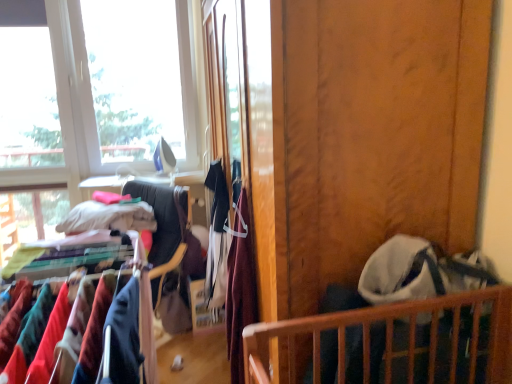
Identify the location of white cotton shirt at center, the 2th clothing from the right. The height and width of the screenshot is (384, 512). (217, 238).

Describe the element at coordinates (389, 339) in the screenshot. I see `wooden crib at lower right` at that location.

At what (x,y) coordinates should I click in order to perform the action: click on velvet burgundy dress at center, which is the 1th clothing from front to back. Please return your answer as a coordinate pair (x, y). The height and width of the screenshot is (384, 512). Looking at the image, I should click on (240, 288).

The width and height of the screenshot is (512, 384). I want to click on white cotton shirt at center, arranged as the 2th clothing when viewed from the front, so click(x=217, y=238).

Consider the image. Is wooden screen door at center not inside wooden crib at lower right?

Yes, wooden screen door at center is located beyond the bounds of wooden crib at lower right.

Could you tell me if wooden screen door at center is turned towards wooden crib at lower right?

No, wooden screen door at center is not turned towards wooden crib at lower right.

From the image's perspective, does wooden screen door at center appear higher than wooden crib at lower right?

Indeed, from the image's perspective, wooden screen door at center is shown above wooden crib at lower right.

Considering the points (439, 381) and (169, 209), which point is in front, point (439, 381) or point (169, 209)?

The point (439, 381) is closer to the camera.

From the image's perspective, relative to velvet fabric clothes at center, is wooden crib at lower right above or below?

Clearly, from the image's perspective, wooden crib at lower right is below velvet fabric clothes at center.

Which of these two, wooden crib at lower right or velvet fabric clothes at center, stands shorter?

wooden crib at lower right is shorter.

Looking at this image, does wooden crib at lower right have a greater width compared to velvet fabric clothes at center?

No.

From a real-world perspective, is wooden crib at lower right physically located above or below velvet burgundy dress at center, which is the 1th clothing from front to back?

In terms of real-world spatial position, wooden crib at lower right is below velvet burgundy dress at center, which is the 1th clothing from front to back.

How many degrees apart are the facing directions of wooden crib at lower right and velvet burgundy dress at center, which is the second clothing from left to right?

The angular difference between wooden crib at lower right and velvet burgundy dress at center, which is the second clothing from left to right, is 1.77 degrees.

Where is `the 1st clothing to the left of the wooden crib at lower right, counting from the anchor's position`? Image resolution: width=512 pixels, height=384 pixels. the 1st clothing to the left of the wooden crib at lower right, counting from the anchor's position is located at coordinates (240, 288).

Is wooden crib at lower right to the left of velvet burgundy dress at center, which is the 1th clothing from front to back, from the viewer's perspective?

No, wooden crib at lower right is not to the left of velvet burgundy dress at center, which is the 1th clothing from front to back.

Which object is further away from the camera taking this photo, wooden screen door at center or velvet burgundy dress at center, marked as the 1th clothing in a right-to-left arrangement?

velvet burgundy dress at center, marked as the 1th clothing in a right-to-left arrangement, is behind.

What's the angular difference between wooden screen door at center and velvet burgundy dress at center, marked as the 1th clothing in a right-to-left arrangement,'s facing directions?

The facing directions of wooden screen door at center and velvet burgundy dress at center, marked as the 1th clothing in a right-to-left arrangement, are 1.53 degrees apart.

Does wooden screen door at center touch velvet burgundy dress at center, which is the second clothing from left to right?

There is a gap between wooden screen door at center and velvet burgundy dress at center, which is the second clothing from left to right.

From a real-world perspective, which object rests below the other?

In real-world perspective, velvet burgundy dress at center, which is the 1th clothing from front to back, is lower.

In terms of size, does velvet burgundy dress at center, which is the second clothing from left to right, appear bigger or smaller than wooden screen door at center?

Clearly, velvet burgundy dress at center, which is the second clothing from left to right, is smaller in size than wooden screen door at center.

Starting from the wooden screen door at center, which clothing is the 1st one behind? Please provide its 2D coordinates.

[(240, 288)]

Can you confirm if velvet burgundy dress at center, which is the second clothing from left to right, is positioned to the left of wooden screen door at center?

Yes.

Is velvet burgundy dress at center, marked as the 1th clothing in a right-to-left arrangement, turned away from wooden screen door at center?

Yes, velvet burgundy dress at center, marked as the 1th clothing in a right-to-left arrangement,'s orientation is away from wooden screen door at center.

Would you consider white cotton shirt at center, the first clothing positioned from the back, to be distant from wooden crib at lower right?

They are positioned close to each other.

Considering the relative sizes of white cotton shirt at center, the 2th clothing from the right, and wooden crib at lower right in the image provided, is white cotton shirt at center, the 2th clothing from the right, wider than wooden crib at lower right?

No, white cotton shirt at center, the 2th clothing from the right, is not wider than wooden crib at lower right.

Is point (226, 269) more distant than point (317, 334)?

Yes, it is.

From the image's perspective, is velvet fabric clothes at center positioned above or below wooden screen door at center?

Based on their image positions, velvet fabric clothes at center is located beneath wooden screen door at center.

Which object is thinner, velvet fabric clothes at center or wooden screen door at center?

Thinner between the two is wooden screen door at center.

Considering the positions of objects velvet fabric clothes at center and wooden screen door at center in the image provided, who is more to the right, velvet fabric clothes at center or wooden screen door at center?

Positioned to the right is wooden screen door at center.

Where is `furniture located behind the wooden screen door at center`? The width and height of the screenshot is (512, 384). furniture located behind the wooden screen door at center is located at coordinates (389, 339).

Where is `closet above the wooden crib at lower right (from the image's perspective)`? The height and width of the screenshot is (384, 512). closet above the wooden crib at lower right (from the image's perspective) is located at coordinates (163, 217).

Looking at the image, which one is located further to wooden screen door at center, velvet fabric clothes at center or white cotton shirt at center, arranged as the 2th clothing when viewed from the front?

velvet fabric clothes at center lies further to wooden screen door at center than the other object.

From the image, which object appears to be nearer to velvet burgundy dress at center, which is the second clothing from left to right, velvet fabric clothes at center or wooden crib at lower right?

The object closer to velvet burgundy dress at center, which is the second clothing from left to right, is wooden crib at lower right.

Based on their spatial positions, is white cotton shirt at center, which is counted as the 1th clothing, starting from the left, or wooden screen door at center further from velvet burgundy dress at center, placed as the 2th clothing when sorted from back to front?

Among the two, wooden screen door at center is located further to velvet burgundy dress at center, placed as the 2th clothing when sorted from back to front.

Estimate the real-world distances between objects in this image. Which object is further from wooden screen door at center, wooden crib at lower right or velvet burgundy dress at center, which is the second clothing from left to right?

velvet burgundy dress at center, which is the second clothing from left to right, is further to wooden screen door at center.

Estimate the real-world distances between objects in this image. Which object is further from wooden screen door at center, velvet fabric clothes at center or velvet burgundy dress at center, placed as the 2th clothing when sorted from back to front?

velvet fabric clothes at center.

Considering their positions, is wooden screen door at center positioned further to wooden crib at lower right than white cotton shirt at center, arranged as the 2th clothing when viewed from the front?

white cotton shirt at center, arranged as the 2th clothing when viewed from the front, is positioned further to the anchor wooden crib at lower right.

When comparing their distances from white cotton shirt at center, the first clothing positioned from the back, does velvet fabric clothes at center or velvet burgundy dress at center, marked as the 1th clothing in a right-to-left arrangement, seem further?

velvet fabric clothes at center lies further to white cotton shirt at center, the first clothing positioned from the back, than the other object.

Estimate the real-world distances between objects in this image. Which object is closer to velvet burgundy dress at center, placed as the 2th clothing when sorted from back to front, velvet fabric clothes at center or wooden screen door at center?

wooden screen door at center is positioned closer to the anchor velvet burgundy dress at center, placed as the 2th clothing when sorted from back to front.

Find the location of `furniture between wooden screen door at center and velvet burgundy dress at center, marked as the 1th clothing in a right-to-left arrangement, from front to back`. furniture between wooden screen door at center and velvet burgundy dress at center, marked as the 1th clothing in a right-to-left arrangement, from front to back is located at coordinates (389, 339).

Locate an element on the screen. The height and width of the screenshot is (384, 512). furniture located between wooden screen door at center and white cotton shirt at center, arranged as the 2th clothing when viewed from the front, in the depth direction is located at coordinates (389, 339).

This screenshot has height=384, width=512. In order to click on clothing between velvet fabric clothes at center and velvet burgundy dress at center, marked as the 1th clothing in a right-to-left arrangement in this screenshot , I will do `click(217, 238)`.

Locate an element on the screen. Image resolution: width=512 pixels, height=384 pixels. clothing between wooden crib at lower right and white cotton shirt at center, arranged as the 2th clothing when viewed from the front, in the front-back direction is located at coordinates (240, 288).